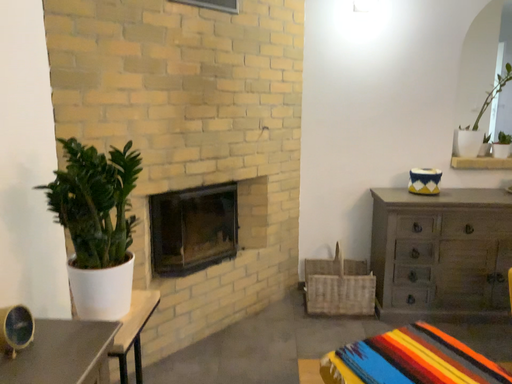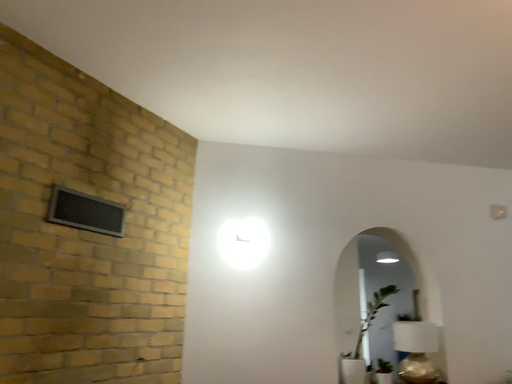
Question: How did the camera likely rotate when shooting the video?

Choices:
 (A) rotated downward
 (B) rotated upward

Answer: (B)